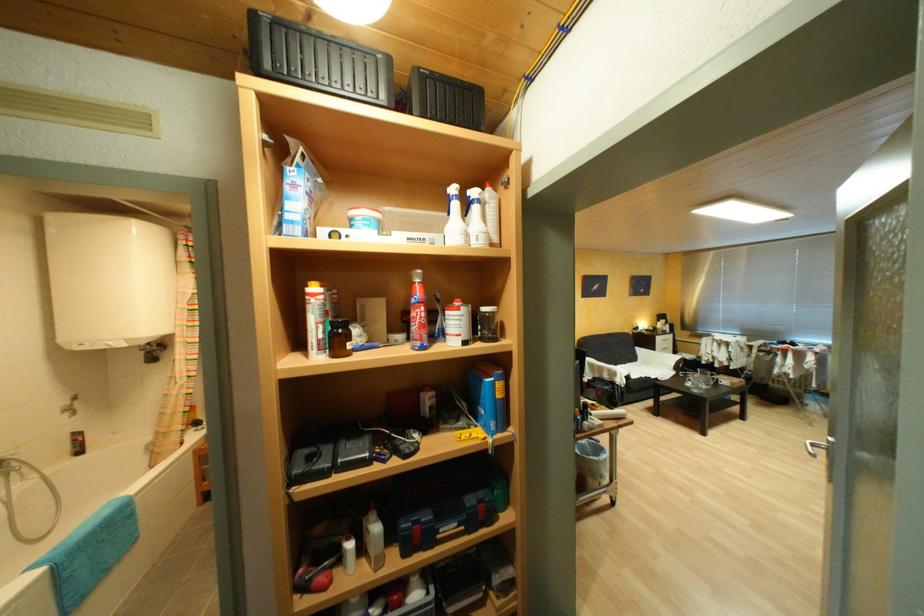
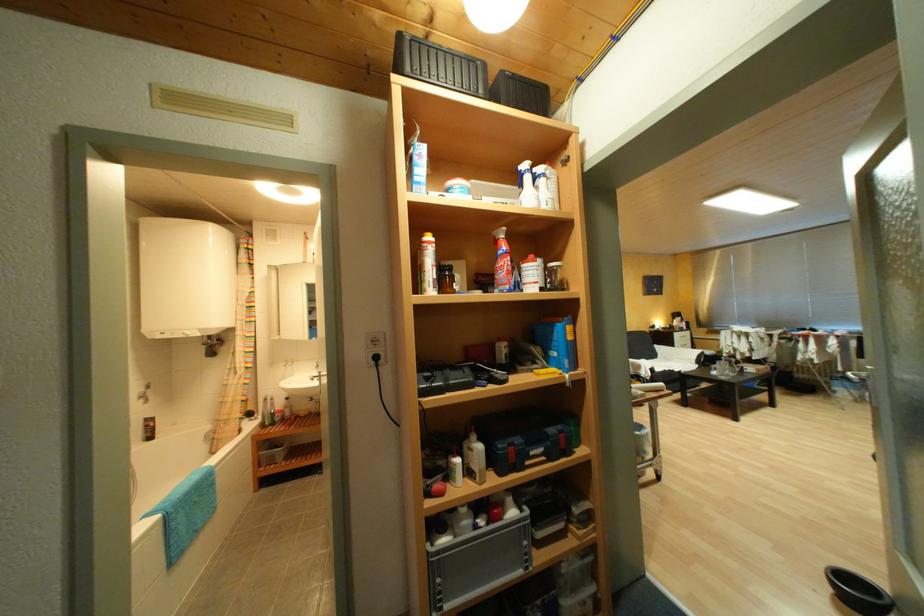
Where in the second image is the point corresponding to [704,392] from the first image?

(732, 379)